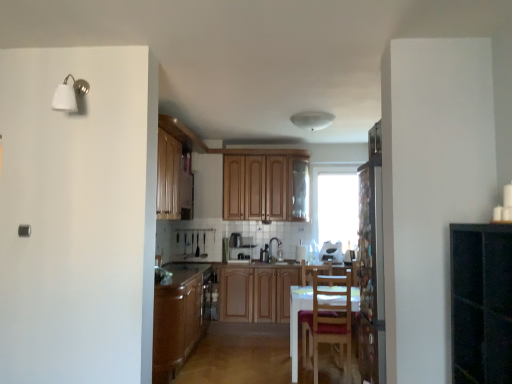
Image resolution: width=512 pixels, height=384 pixels. I want to click on matte brown countertop at lower center, so (x=181, y=273).

The image size is (512, 384). What do you see at coordinates (234, 240) in the screenshot?
I see `satin silver toaster at center, the first appliance when ordered from left to right` at bounding box center [234, 240].

Image resolution: width=512 pixels, height=384 pixels. What do you see at coordinates (328, 320) in the screenshot?
I see `wooden chair at center` at bounding box center [328, 320].

What is the approximate height of wooden chair at center?

The height of wooden chair at center is 3.40 feet.

The image size is (512, 384). I want to click on wooden cabinets at center, the first cabinetry in the top-to-bottom sequence, so click(265, 186).

This screenshot has width=512, height=384. What do you see at coordinates (239, 248) in the screenshot?
I see `wooden cabinet at center, which is the second appliance from right to left` at bounding box center [239, 248].

At what (x,y) coordinates should I click in order to perform the action: click on matte brown countertop at lower center. Please return your answer as a coordinate pair (x, y). The height and width of the screenshot is (384, 512). Looking at the image, I should click on (181, 273).

Is matte brown countertop at lower center completely or partially outside of brown wood cabinet at center, the 1th cabinetry from the front?

Absolutely, matte brown countertop at lower center is external to brown wood cabinet at center, the 1th cabinetry from the front.

From a real-world perspective, is matte brown countertop at lower center on top of brown wood cabinet at center, placed as the first cabinetry when sorted from bottom to top?

Indeed, from a real-world perspective, matte brown countertop at lower center stands above brown wood cabinet at center, placed as the first cabinetry when sorted from bottom to top.

Which is farther from the camera, (203, 270) or (180, 349)?

Point (203, 270)

Is brown wood cabinet at center, the first cabinetry when ordered from left to right, taller or shorter than wooden chair at center?

In the image, brown wood cabinet at center, the first cabinetry when ordered from left to right, appears to be shorter than wooden chair at center.

Looking at this image, which is more to the left, brown wood cabinet at center, which is the 2th cabinetry in top-to-bottom order, or wooden chair at center?

brown wood cabinet at center, which is the 2th cabinetry in top-to-bottom order.

Would you say wooden chair at center is part of brown wood cabinet at center, the 1th cabinetry from the front,'s contents?

No, wooden chair at center is not surrounded by brown wood cabinet at center, the 1th cabinetry from the front.

Which of these two, brown wood cabinet at center, placed as the first cabinetry when sorted from bottom to top, or wooden chair at center, is bigger?

brown wood cabinet at center, placed as the first cabinetry when sorted from bottom to top.

Which of these two, white glossy toaster at center, which is counted as the 1th appliance, starting from the right, or brown wood cabinet at center, arranged as the second cabinetry when viewed from the back, is bigger?

brown wood cabinet at center, arranged as the second cabinetry when viewed from the back, is bigger.

Can you confirm if white glossy toaster at center, placed as the third appliance when sorted from left to right, is shorter than brown wood cabinet at center, the first cabinetry when ordered from left to right?

Yes.

Which is less distant, (330,253) or (174,304)?

The point (174,304) is more forward.

Is white glossy toaster at center, which is counted as the 1th appliance, starting from the right, to the right of brown wood cabinet at center, placed as the first cabinetry when sorted from bottom to top, from the viewer's perspective?

Yes, white glossy toaster at center, which is counted as the 1th appliance, starting from the right, is to the right of brown wood cabinet at center, placed as the first cabinetry when sorted from bottom to top.

What's the angular difference between wooden chair at center and transparent glass window at center's facing directions?

The facing directions of wooden chair at center and transparent glass window at center are 177 degrees apart.

Is wooden chair at center in front of or behind transparent glass window at center in the image?

Visually, wooden chair at center is located in front of transparent glass window at center.

Does wooden chair at center have a larger size compared to transparent glass window at center?

Correct, wooden chair at center is larger in size than transparent glass window at center.

Can you see matte brown countertop at lower center touching satin silver toaster at center, arranged as the 3th appliance when viewed from the right?

No, matte brown countertop at lower center is not making contact with satin silver toaster at center, arranged as the 3th appliance when viewed from the right.

Does point (204, 279) lie in front of point (229, 245)?

Yes, it is.

Between matte brown countertop at lower center and satin silver toaster at center, arranged as the 3th appliance when viewed from the right, which one is positioned in front?

Positioned in front is matte brown countertop at lower center.

In the scene shown: Is matte brown countertop at lower center bigger or smaller than wooden cabinet at center, arranged as the second appliance when viewed from the left?

→ In the image, matte brown countertop at lower center appears to be larger than wooden cabinet at center, arranged as the second appliance when viewed from the left.

Can wooden cabinet at center, which is the second appliance from right to left, be found inside matte brown countertop at lower center?

Actually, wooden cabinet at center, which is the second appliance from right to left, is outside matte brown countertop at lower center.

In the scene shown: Is matte brown countertop at lower center facing towards wooden cabinet at center, arranged as the second appliance when viewed from the left?

No, matte brown countertop at lower center is not aimed at wooden cabinet at center, arranged as the second appliance when viewed from the left.

Is wooden cabinet at center, arranged as the second appliance when viewed from the left, further to the viewer compared to wooden cabinets at center, acting as the first cabinetry starting from the right?

Yes, wooden cabinet at center, arranged as the second appliance when viewed from the left, is behind wooden cabinets at center, acting as the first cabinetry starting from the right.

From the image's perspective, which is above, wooden cabinet at center, which is the second appliance from right to left, or wooden cabinets at center, the second cabinetry in the bottom-to-top sequence?

wooden cabinets at center, the second cabinetry in the bottom-to-top sequence, appears higher in the image.

Where is `appliance that is the 1st object located behind the wooden cabinets at center, acting as the first cabinetry starting from the right`? This screenshot has height=384, width=512. appliance that is the 1st object located behind the wooden cabinets at center, acting as the first cabinetry starting from the right is located at coordinates (239, 248).

Does wooden cabinet at center, arranged as the second appliance when viewed from the left, have a greater width compared to wooden cabinets at center, the first cabinetry in the top-to-bottom sequence?

Indeed, wooden cabinet at center, arranged as the second appliance when viewed from the left, has a greater width compared to wooden cabinets at center, the first cabinetry in the top-to-bottom sequence.

This screenshot has height=384, width=512. Identify the location of counter top that is above the brown wood cabinet at center, the first cabinetry when ordered from left to right (from the image's perspective). (181, 273).

Where is `chair on the right of brown wood cabinet at center, placed as the first cabinetry when sorted from bottom to top`? Image resolution: width=512 pixels, height=384 pixels. chair on the right of brown wood cabinet at center, placed as the first cabinetry when sorted from bottom to top is located at coordinates [x=328, y=320].

In the scene shown: Which object lies nearer to the anchor point wooden chair at center, transparent glass window at center or white glossy toaster at center, placed as the third appliance when sorted from left to right?

white glossy toaster at center, placed as the third appliance when sorted from left to right, lies closer to wooden chair at center than the other object.

Based on their spatial positions, is brown wood cabinet at center, the first cabinetry when ordered from left to right, or wooden cabinets at center, which is counted as the first cabinetry, starting from the back, closer to transparent glass window at center?

Based on the image, wooden cabinets at center, which is counted as the first cabinetry, starting from the back, appears to be nearer to transparent glass window at center.

Based on their spatial positions, is transparent glass window at center or white glossy toaster at center, placed as the third appliance when sorted from left to right, closer to matte brown countertop at lower center?

The object closer to matte brown countertop at lower center is white glossy toaster at center, placed as the third appliance when sorted from left to right.

Based on their spatial positions, is wooden chair at center or white glossy toaster at center, which is counted as the 1th appliance, starting from the right, further from transparent glass window at center?

wooden chair at center.

Estimate the real-world distances between objects in this image. Which object is further from wooden chair at center, wooden cabinets at center, the second cabinetry viewed from the left, or brown wood cabinet at center, which is the 2th cabinetry in top-to-bottom order?

wooden cabinets at center, the second cabinetry viewed from the left, is positioned further to the anchor wooden chair at center.

When comparing their distances from satin silver toaster at center, arranged as the 3th appliance when viewed from the right, does brown wood cabinet at center, the 1th cabinetry from the front, or matte brown countertop at lower center seem closer?

The object closer to satin silver toaster at center, arranged as the 3th appliance when viewed from the right, is matte brown countertop at lower center.

Based on their spatial positions, is wooden cabinets at center, the first cabinetry in the top-to-bottom sequence, or transparent glass window at center closer to satin silver toaster at center, the first appliance when ordered from left to right?

wooden cabinets at center, the first cabinetry in the top-to-bottom sequence, lies closer to satin silver toaster at center, the first appliance when ordered from left to right, than the other object.

Estimate the real-world distances between objects in this image. Which object is further from satin silver toaster at center, the first appliance when ordered from left to right, matte brown countertop at lower center or brown wood cabinet at center, which is the 2th cabinetry in top-to-bottom order?

brown wood cabinet at center, which is the 2th cabinetry in top-to-bottom order, is further to satin silver toaster at center, the first appliance when ordered from left to right.

I want to click on appliance positioned between brown wood cabinet at center, which is the 2th cabinetry in top-to-bottom order, and wooden cabinet at center, which is the second appliance from right to left, from near to far, so coord(331,252).

This screenshot has width=512, height=384. Find the location of `counter top between brown wood cabinet at center, the second cabinetry viewed from the right, and wooden cabinet at center, which is the second appliance from right to left, in the front-back direction`. counter top between brown wood cabinet at center, the second cabinetry viewed from the right, and wooden cabinet at center, which is the second appliance from right to left, in the front-back direction is located at coordinates (181, 273).

I want to click on appliance positioned between wooden chair at center and wooden cabinet at center, arranged as the second appliance when viewed from the left, from near to far, so click(x=331, y=252).

You are a GUI agent. You are given a task and a screenshot of the screen. Output one action in this format:
    pyautogui.click(x=<x>, y=<y>)
    Task: Click on the counter top located between brown wood cabinet at center, the second cabinetry viewed from the right, and wooden cabinets at center, the second cabinetry viewed from the left, in the depth direction
    
    Given the screenshot: What is the action you would take?
    pyautogui.click(x=181, y=273)